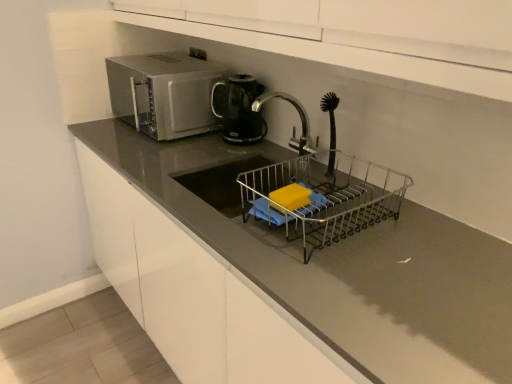
The height and width of the screenshot is (384, 512). What are the coordinates of `free space in front of satin silver microwave at upper left` in the screenshot? It's located at (154, 152).